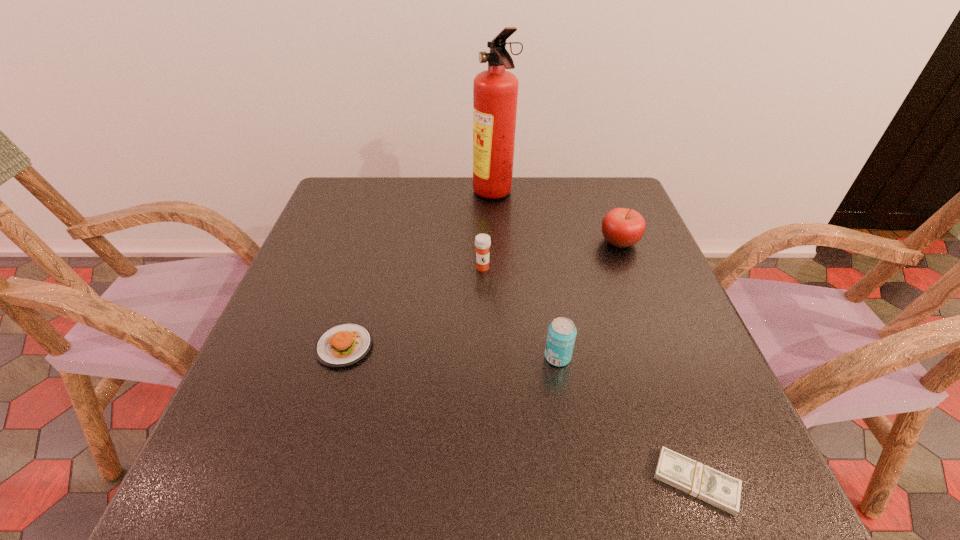
I want to click on blank area located on the front-facing side of the fire extinguisher, so click(381, 194).

Where is `free space located on the front-facing side of the fire extinguisher`? This screenshot has width=960, height=540. free space located on the front-facing side of the fire extinguisher is located at coordinates (371, 194).

I want to click on free point located on the front of the fifth nearest object, so click(x=662, y=354).

Image resolution: width=960 pixels, height=540 pixels. In order to click on free space located on the front of the fourth object from left to right in this screenshot , I will do [577, 473].

Identify the location of vacant space located on the label side of the third farthest object. (484, 418).

This screenshot has width=960, height=540. I want to click on free space located on the front of the food, so click(305, 482).

In order to click on vacant region located on the back of the nearest object in this screenshot , I will do (663, 393).

You are a GUI agent. You are given a task and a screenshot of the screen. Output one action in this format:
    pyautogui.click(x=<x>, y=<y>)
    Task: Click on the object that is at the far edge
    Image resolution: width=960 pixels, height=540 pixels.
    Given the screenshot: What is the action you would take?
    pyautogui.click(x=495, y=91)

At what (x,y) coordinates should I click in order to perform the action: click on object at the near edge. Please return your answer as a coordinate pair (x, y). This screenshot has width=960, height=540. Looking at the image, I should click on (705, 483).

The width and height of the screenshot is (960, 540). I want to click on object that is at the left edge, so pyautogui.click(x=342, y=345).